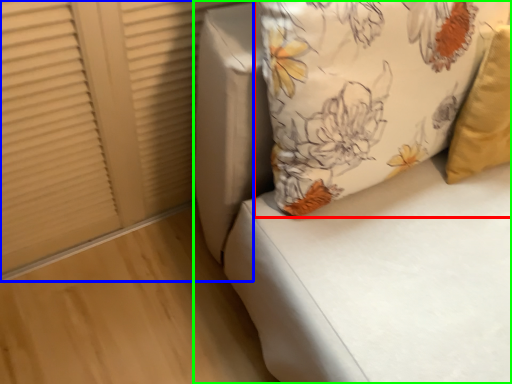
Question: Which object is the closest to the pillow (highlighted by a red box)? Choose among these: shutter (highlighted by a blue box) or furniture (highlighted by a green box).

Choices:
 (A) shutter
 (B) furniture

Answer: (B)